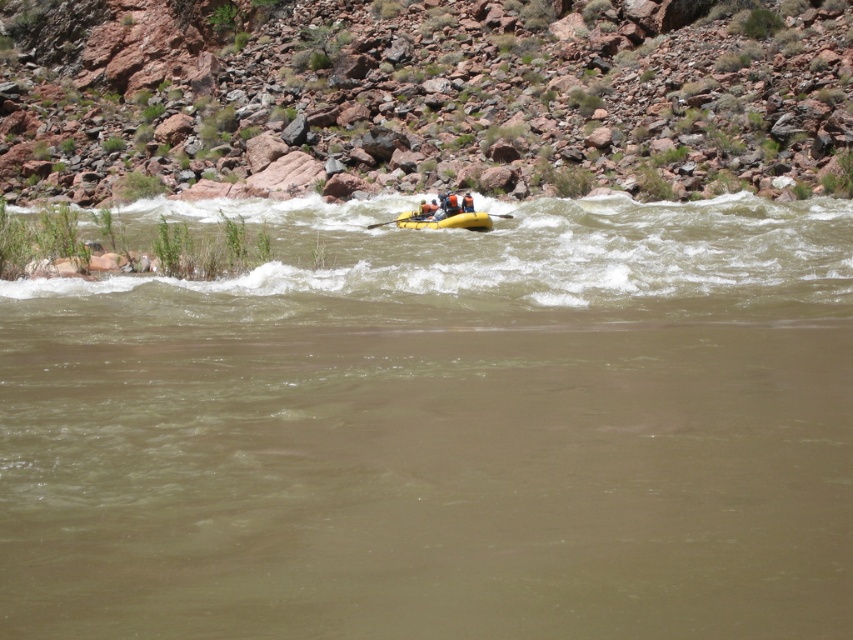
Question: Does yellow rubber boat at center have a smaller size compared to yellow rubber paddle at center?

Choices:
 (A) no
 (B) yes

Answer: (A)

Question: Considering the relative positions of rusty rock at center and yellow rubber paddle at center in the image provided, where is rusty rock at center located with respect to yellow rubber paddle at center?

Choices:
 (A) below
 (B) above

Answer: (B)

Question: Estimate the real-world distances between objects in this image. Which object is closer to the brown rubber raft at center?

Choices:
 (A) orange life vest at center
 (B) yellow rubber paddle at center
 (C) yellow rubber boat at center
 (D) rusty rock at center

Answer: (C)

Question: Does yellow rubber boat at center appear over yellow rubber paddle at center?

Choices:
 (A) yes
 (B) no

Answer: (A)

Question: Which object is the farthest from the orange life vest at center?

Choices:
 (A) yellow rubber boat at center
 (B) rusty rock at center
 (C) yellow rubber paddle at center
 (D) brown rubber raft at center

Answer: (B)

Question: Estimate the real-world distances between objects in this image. Which object is closer to the rusty rock at center?

Choices:
 (A) brown rubber raft at center
 (B) yellow rubber boat at center
 (C) orange life vest at center

Answer: (B)